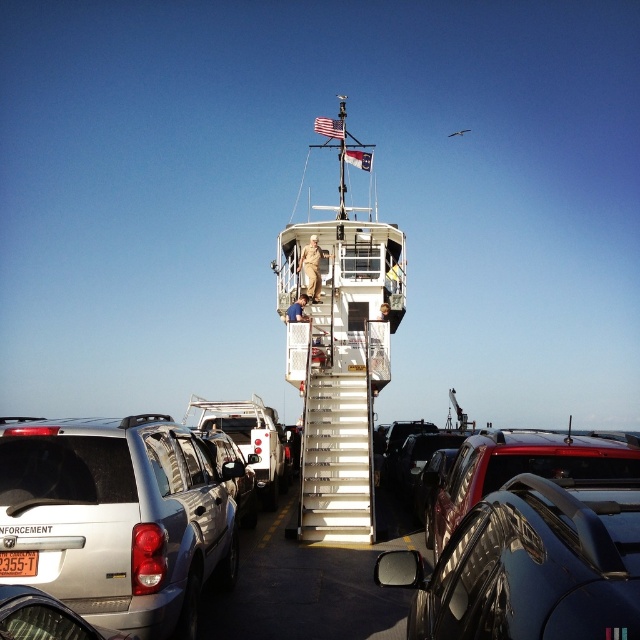
Which of these two, silver metallic suv at lower left or glossy black car at lower right, stands taller?

silver metallic suv at lower left

Can you confirm if silver metallic suv at lower left is thinner than glossy black car at lower right?

No, silver metallic suv at lower left is not thinner than glossy black car at lower right.

Where is `silver metallic suv at lower left`? This screenshot has width=640, height=640. silver metallic suv at lower left is located at coordinates (118, 516).

What do you see at coordinates (525, 467) in the screenshot?
I see `shiny black truck at lower right` at bounding box center [525, 467].

Where is `shiny black truck at lower right`? The height and width of the screenshot is (640, 640). shiny black truck at lower right is located at coordinates (525, 467).

Is glossy black car at lower right wider than silver metallic car at lower left?

Indeed, glossy black car at lower right has a greater width compared to silver metallic car at lower left.

Who is positioned more to the right, glossy black car at lower right or silver metallic car at lower left?

Positioned to the right is glossy black car at lower right.

Does point (548, 554) come farther from viewer compared to point (80, 637)?

No, (548, 554) is in front of (80, 637).

Find the location of a particular element. The image size is (640, 640). glossy black car at lower right is located at coordinates (529, 566).